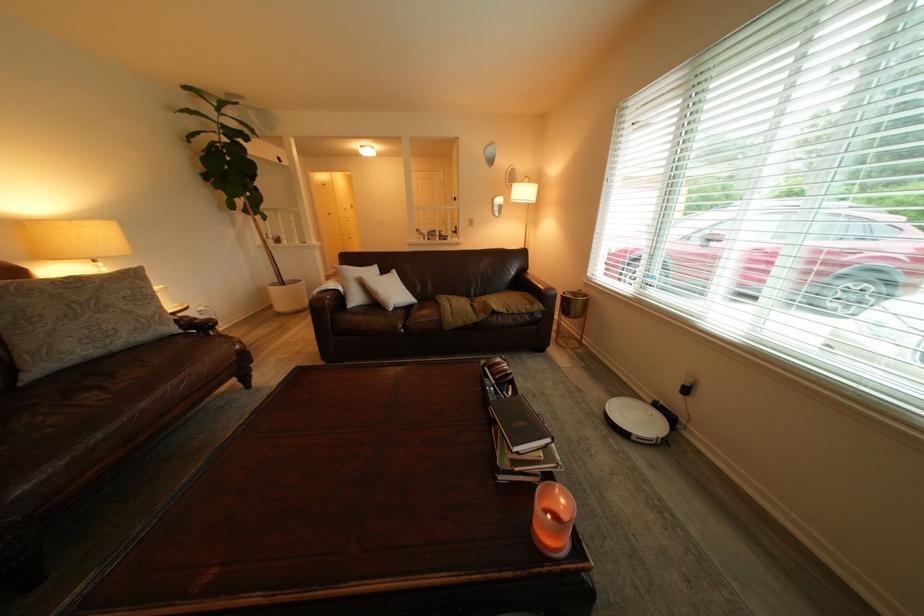
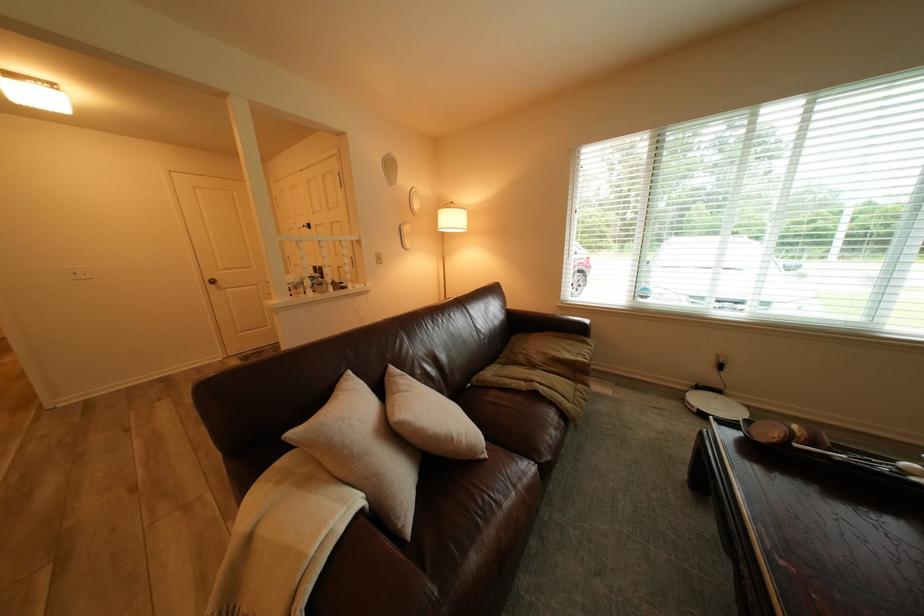
The point at (671, 406) is marked in the first image. Where is the corresponding point in the second image?

(712, 389)